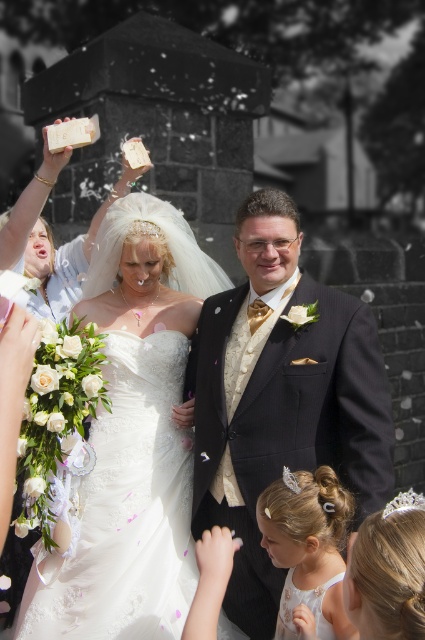
You are a photographer standing at the back of the wedding venue. You need to capture a photo of both the white satin dress at center and the white lace dress at lower right in the same frame. Given that your camera has a maximum zoom range of 5 meters, will you be able to fit both dresses into the frame without moving closer?

The white satin dress at center and white lace dress at lower right are 5.18 meters apart. Since the camera can only zoom up to 5 meters, the distance between them exceeds the maximum zoom range. Therefore, you cannot fit both dresses into the frame without moving closer.

You are a photographer at the wedding. You need to place a decoration at the point with coordinates point (133, 440). Where exactly should you place it?

The point (133, 440) is on the white satin dress at center, so you should place the decoration on the white satin dress at center.

You are standing at the point marked at coordinates (x=280, y=397) in the image. Looking around, you see the bride in white gown at center and the groom in dark suit at center. Which direction should you face to see the shiny black suit at center?

The point marked at coordinates (x=280, y=397) is on the shiny black suit at center, so you are already facing the shiny black suit at center.